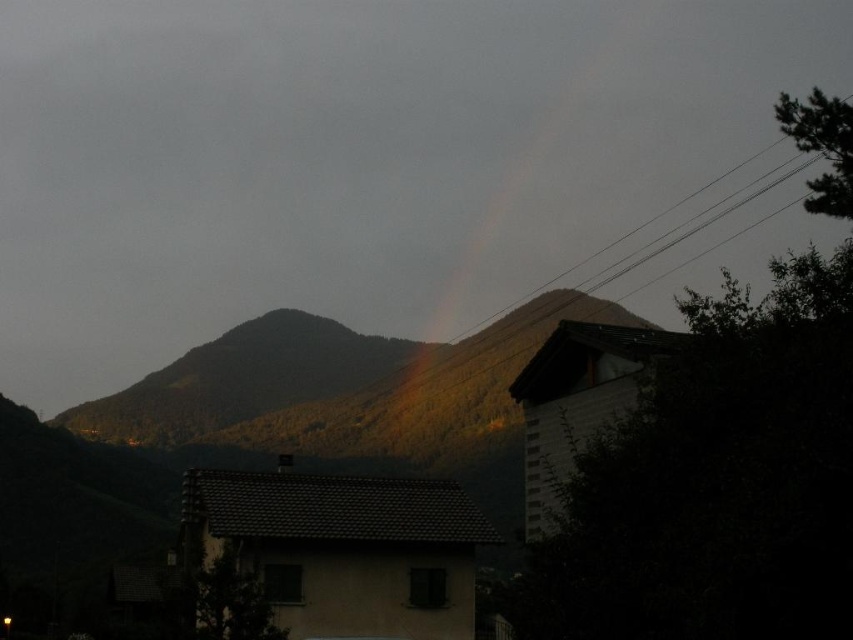
You are a painter who wants to capture the scene in front of you. You notice the green forested mountain at center and the rainbow at upper center. Which object takes up more space in the painting?

The rainbow at upper center takes up more space in the painting because the green forested mountain at center occupies less space than the rainbow at upper center.

You are standing at the viewpoint of the image and want to reach a specific point marked at coordinates point (547, 333). If your walking speed is 3 feet per second, how many seconds will it take you to reach that point?

The distance of point (547, 333) from viewer is 378.20 feet. At a speed of 3 feet per second, it will take 378.20 divided by 3 equals approximately 126.07 seconds to reach the point.

You are an artist planning to paint the scene. You want to ensure the green forested mountain at center is narrower than the rainbow at upper center in your painting. Does the current scene allow this?

Yes, the green forested mountain at center is already narrower than the rainbow at upper center in the scene, so you can accurately represent this in your painting.